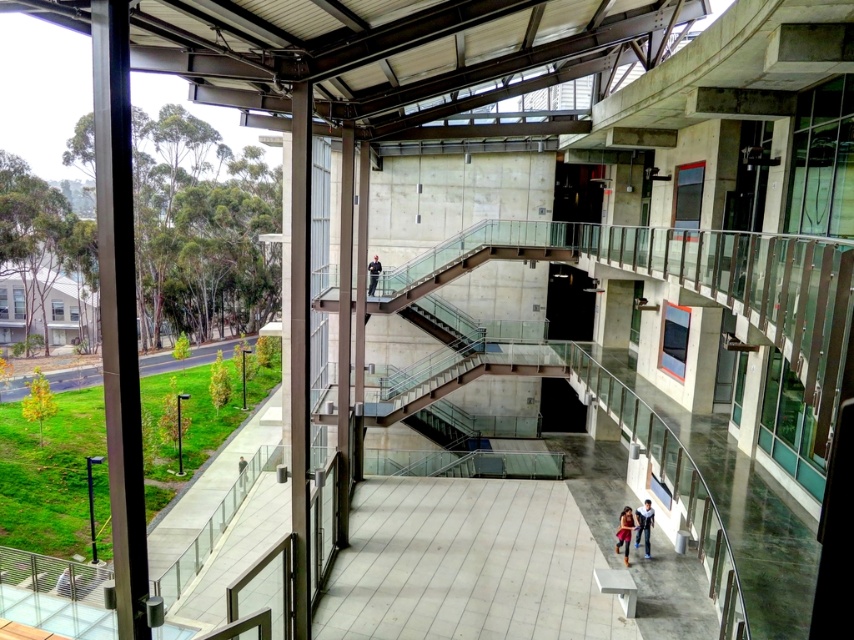
Who is positioned more to the left, blue jeans at lower center or matte black jacket at lower center?

Positioned to the left is matte black jacket at lower center.

Which is below, blue jeans at lower center or matte black jacket at lower center?

matte black jacket at lower center is below.

The height and width of the screenshot is (640, 854). Describe the element at coordinates (644, 525) in the screenshot. I see `blue jeans at lower center` at that location.

The image size is (854, 640). I want to click on blue jeans at lower center, so click(644, 525).

Is point (624, 518) closer to viewer compared to point (371, 266)?

Yes, it is in front of point (371, 266).

What do you see at coordinates (624, 531) in the screenshot?
I see `matte black jacket at lower center` at bounding box center [624, 531].

Between point (617, 541) and point (373, 284), which one is positioned behind?

The point (373, 284) is behind.

Where is `matte black jacket at lower center`? matte black jacket at lower center is located at coordinates (624, 531).

Is blue jeans at lower center positioned behind dark blue uniform at center?

No, blue jeans at lower center is in front of dark blue uniform at center.

Is point (648, 506) closer to camera compared to point (367, 266)?

Yes, point (648, 506) is closer to viewer.

Between point (636, 531) and point (375, 278), which one is positioned in front?

Positioned in front is point (636, 531).

The image size is (854, 640). I want to click on blue jeans at lower center, so click(644, 525).